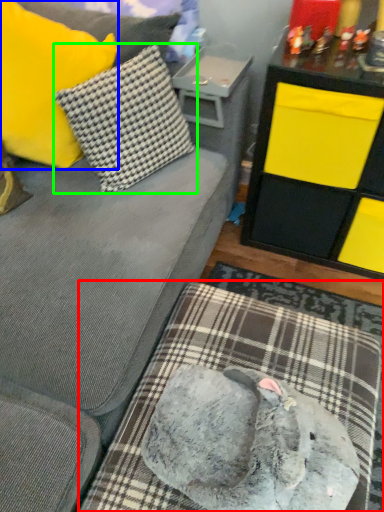
Question: Which object is positioned farthest from dog bed (highlighted by a red box)? Select from pillow (highlighted by a blue box) and pillow (highlighted by a green box).

Choices:
 (A) pillow
 (B) pillow

Answer: (A)